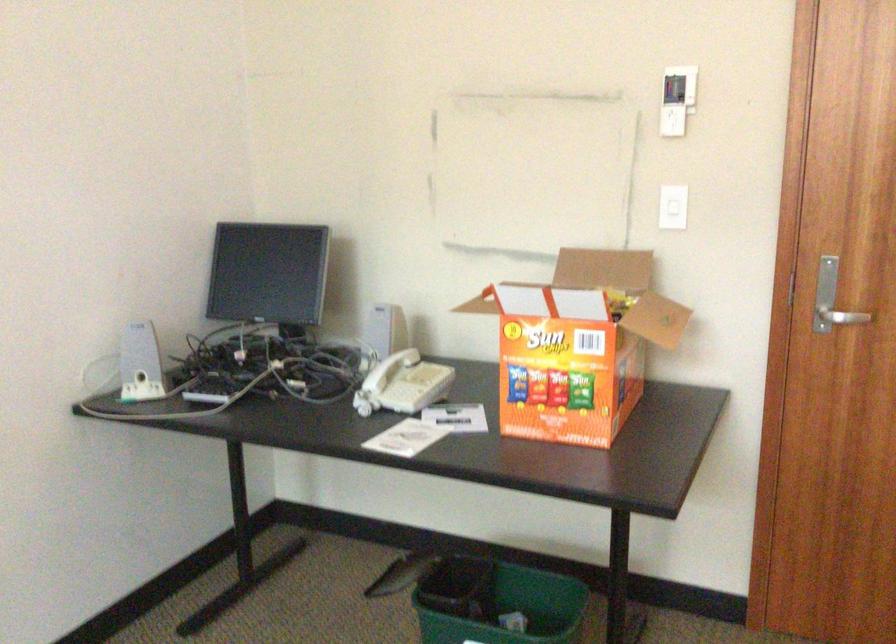
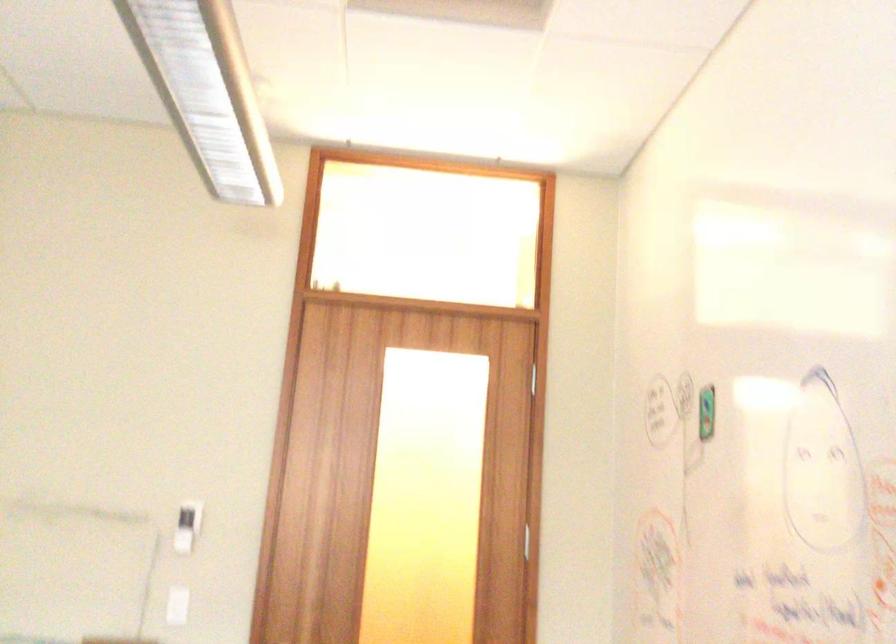
How did the camera likely rotate?

The rotation direction of the camera is right-up.